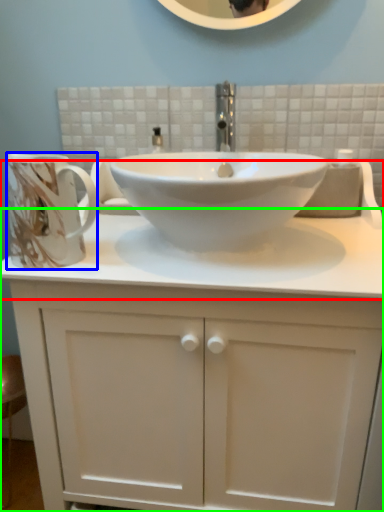
Question: Which object is positioned farthest from counter top (highlighted by a red box)? Select from mug (highlighted by a blue box) and bathroom cabinet (highlighted by a green box).

Choices:
 (A) mug
 (B) bathroom cabinet

Answer: (A)